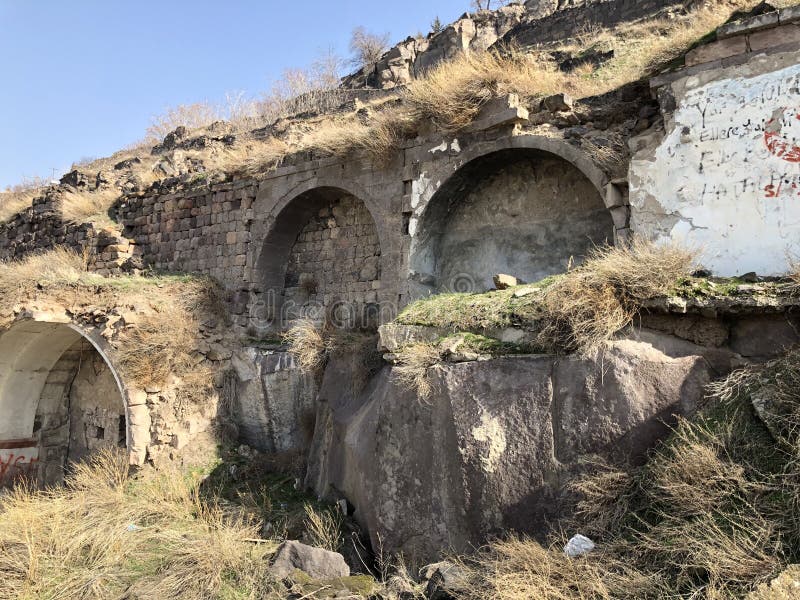
Where is `white paint`? white paint is located at coordinates tap(746, 228).